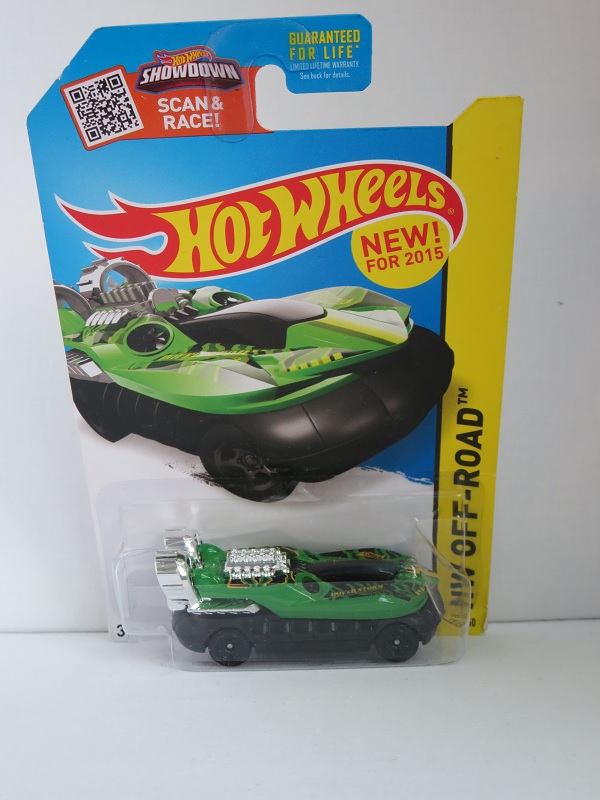
At what (x,y) coordinates should I click in order to perform the action: click on toy car on box. Please return your answer as a coordinate pair (x, y). This screenshot has height=800, width=600. Looking at the image, I should click on (234, 346).